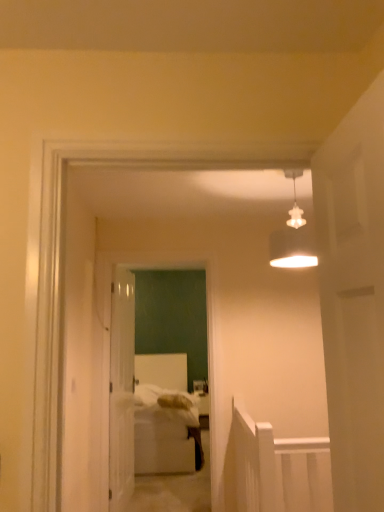
Where is `free location above white glossy door at center (from a real-world perspective)`? The width and height of the screenshot is (384, 512). free location above white glossy door at center (from a real-world perspective) is located at coordinates [x=157, y=249].